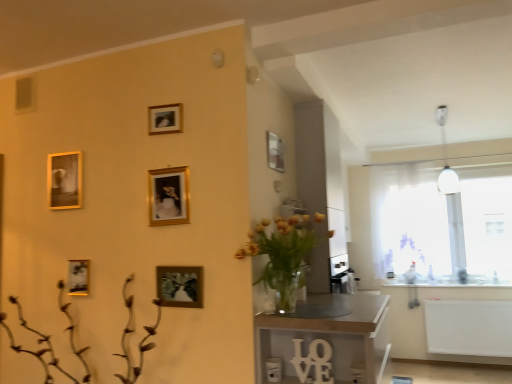
Question: Does white sheer curtain at right have a greater height compared to wooden table at center?

Choices:
 (A) yes
 (B) no

Answer: (A)

Question: Is the position of white sheer curtain at right less distant than that of wooden table at center?

Choices:
 (A) no
 (B) yes

Answer: (A)

Question: Is white sheer curtain at right not close to wooden table at center?

Choices:
 (A) yes
 (B) no

Answer: (A)

Question: Does white sheer curtain at right have a lesser height compared to wooden table at center?

Choices:
 (A) no
 (B) yes

Answer: (A)

Question: From a real-world perspective, does white sheer curtain at right stand above wooden table at center?

Choices:
 (A) yes
 (B) no

Answer: (A)

Question: In terms of height, does gold metallic picture frame at center, marked as the fourth picture frame in a left-to-right arrangement, look taller or shorter compared to brown matte plant at lower left?

Choices:
 (A) short
 (B) tall

Answer: (A)

Question: Is point (183, 185) positioned closer to the camera than point (51, 349)?

Choices:
 (A) farther
 (B) closer

Answer: (B)

Question: Do you think gold metallic picture frame at center, marked as the third picture frame in a bottom-to-top arrangement, is within brown matte plant at lower left, or outside of it?

Choices:
 (A) inside
 (B) outside

Answer: (B)

Question: From a real-world perspective, is gold metallic picture frame at center, arranged as the third picture frame when viewed from the top, physically located above or below brown matte plant at lower left?

Choices:
 (A) above
 (B) below

Answer: (A)

Question: Is brown matte plant at lower left in front of or behind gold metallic picture frame at upper center, which is the third picture frame from left to right, in the image?

Choices:
 (A) front
 (B) behind

Answer: (A)

Question: Is brown matte plant at lower left taller or shorter than gold metallic picture frame at upper center, which is the third picture frame from left to right?

Choices:
 (A) short
 (B) tall

Answer: (B)

Question: In the image, is brown matte plant at lower left on the left side or the right side of gold metallic picture frame at upper center, which is the 3th picture frame in right-to-left order?

Choices:
 (A) left
 (B) right

Answer: (A)

Question: From a real-world perspective, relative to gold metallic picture frame at upper center, which is the first picture frame in top-to-bottom order, is brown matte plant at lower left vertically above or below?

Choices:
 (A) below
 (B) above

Answer: (A)

Question: From a real-world perspective, is brown matte plant at lower left physically located above or below gold metallic picture frame at lower left, the fourth picture frame positioned from the top?

Choices:
 (A) above
 (B) below

Answer: (B)

Question: Looking at the image, does brown matte plant at lower left seem bigger or smaller compared to gold metallic picture frame at lower left, the fourth picture frame positioned from the top?

Choices:
 (A) small
 (B) big

Answer: (B)